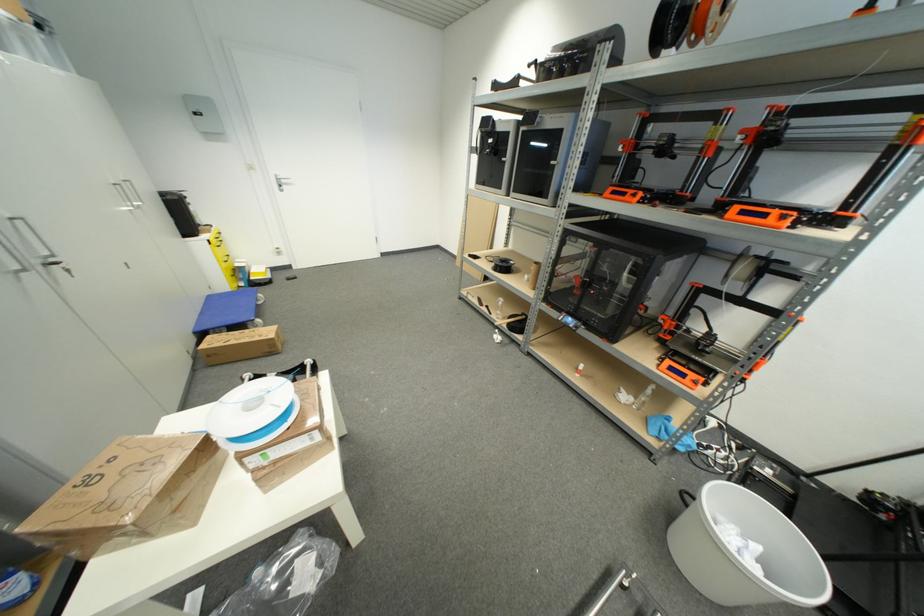
Describe the element at coordinates (66, 270) in the screenshot. Image resolution: width=924 pixels, height=616 pixels. I see `the cabinet keyhole` at that location.